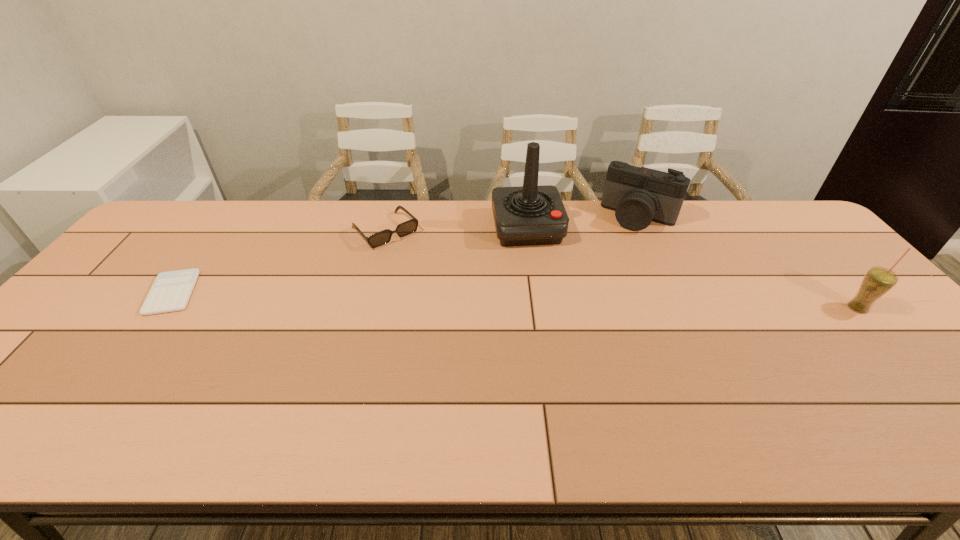
The height and width of the screenshot is (540, 960). Identify the location of empty space that is in between the straw for drinking and the camera. (749, 262).

Where is `the fourth closest object relative to the second object from right to left`? This screenshot has width=960, height=540. the fourth closest object relative to the second object from right to left is located at coordinates (171, 291).

Identify which object is the fourth nearest to the second object from right to left. Please provide its 2D coordinates. Your answer should be formatted as a tuple, i.e. [(x, y)], where the tuple contains the x and y coordinates of a point satisfying the conditions above.

[(171, 291)]

The image size is (960, 540). Identify the location of free location that satisfies the following two spatial constraints: 1. on the front side of the straw for drinking; 2. on the right side of the calculator. (161, 308).

In order to click on free spot that satisfies the following two spatial constraints: 1. on the front side of the straw for drinking; 2. on the left side of the third object from right to left in this screenshot , I will do `click(538, 308)`.

At what (x,y) coordinates should I click in order to perform the action: click on vacant space that satisfies the following two spatial constraints: 1. on the back side of the fourth object from right to left; 2. on the right side of the camera. Please return your answer as a coordinate pair (x, y). This screenshot has width=960, height=540. Looking at the image, I should click on (389, 217).

The height and width of the screenshot is (540, 960). What are the coordinates of `free location that satisfies the following two spatial constraints: 1. on the back side of the leftmost object; 2. on the left side of the sunglasses` in the screenshot? It's located at (219, 231).